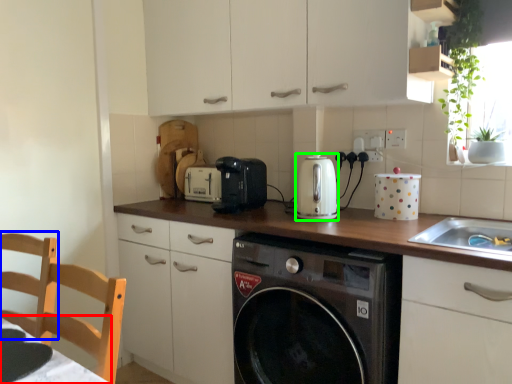
Question: Which object is the farthest from table (highlighted by a red box)? Choose among these: chair (highlighted by a blue box) or kitchen appliance (highlighted by a green box).

Choices:
 (A) chair
 (B) kitchen appliance

Answer: (B)